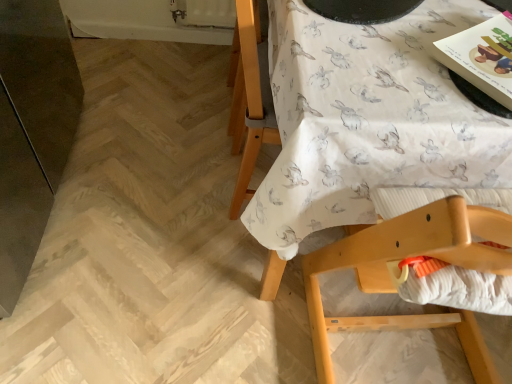
Identify the location of free point to the left of white fabric with rabbit print at upper right. This screenshot has width=512, height=384. (134, 155).